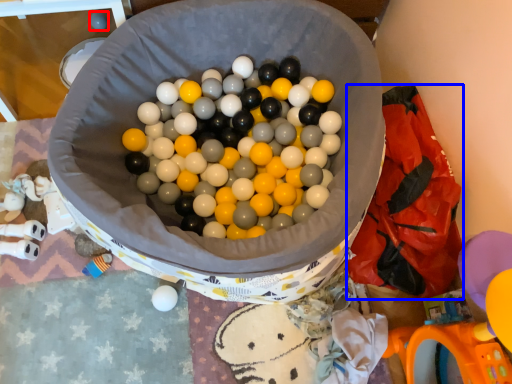
Question: Which object appears farthest to the camera in this image, toy (highlighted by a red box) or material (highlighted by a blue box)?

Choices:
 (A) toy
 (B) material

Answer: (A)